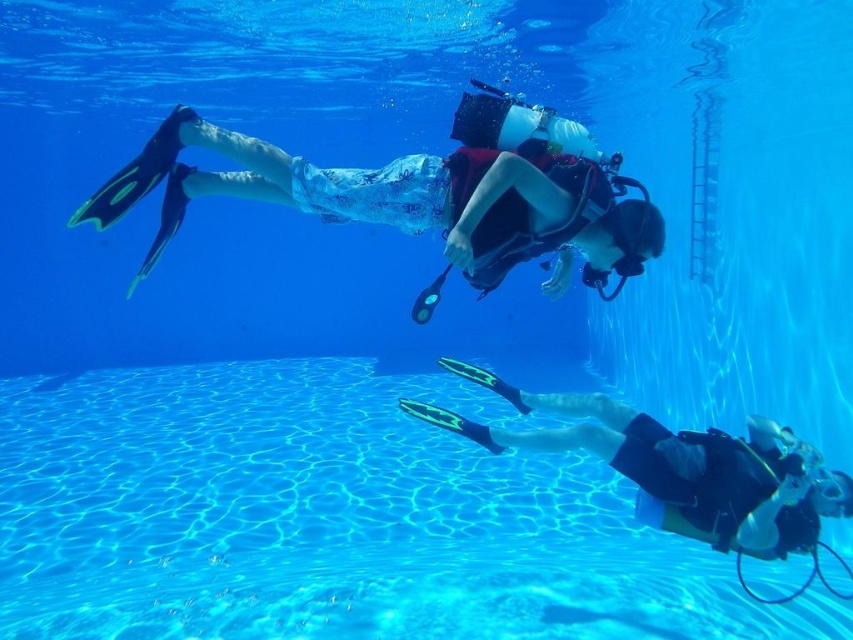
Can you confirm if clear blue water at lower center is thinner than black matte fins at lower right?

Incorrect, clear blue water at lower center's width is not less than black matte fins at lower right's.

Who is positioned more to the right, clear blue water at lower center or black matte fins at lower right?

black matte fins at lower right is more to the right.

Which is in front, point (402, 381) or point (740, 468)?

Point (740, 468)

At what (x,y) coordinates should I click in order to perform the action: click on clear blue water at lower center. Please return your answer as a coordinate pair (x, y). The width and height of the screenshot is (853, 640). Looking at the image, I should click on (332, 518).